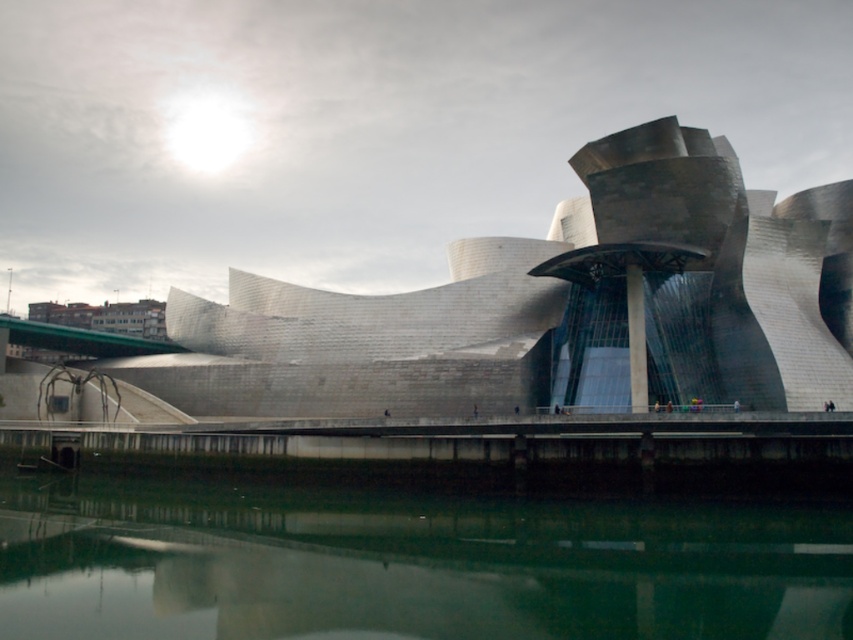
Question: Is polished steel building at center positioned in front of green reflective water at lower center?

Choices:
 (A) yes
 (B) no

Answer: (B)

Question: Is polished steel building at center wider than green reflective water at lower center?

Choices:
 (A) no
 (B) yes

Answer: (B)

Question: Is polished steel building at center positioned behind green reflective water at lower center?

Choices:
 (A) yes
 (B) no

Answer: (A)

Question: Which point appears closest to the camera in this image?

Choices:
 (A) (659, 392)
 (B) (339, 524)

Answer: (B)